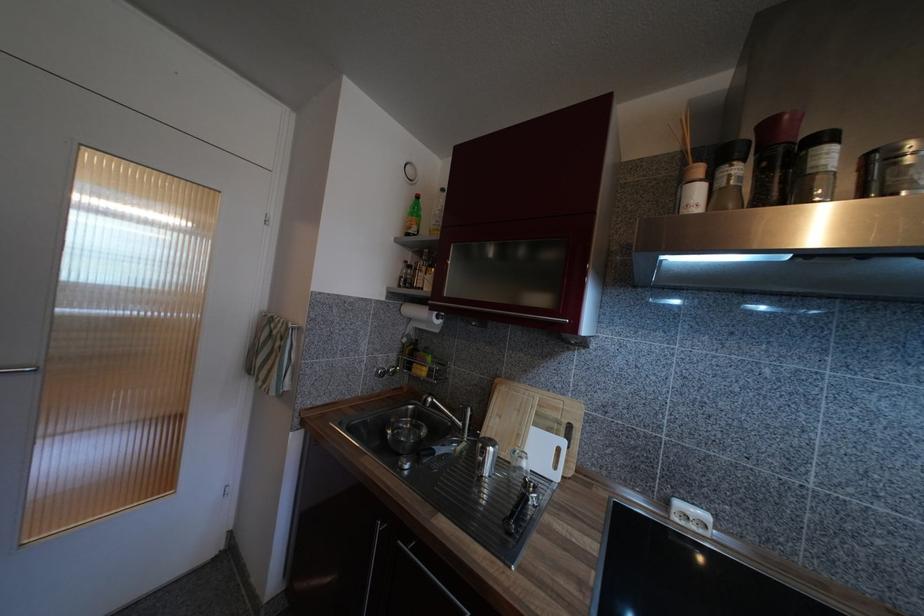
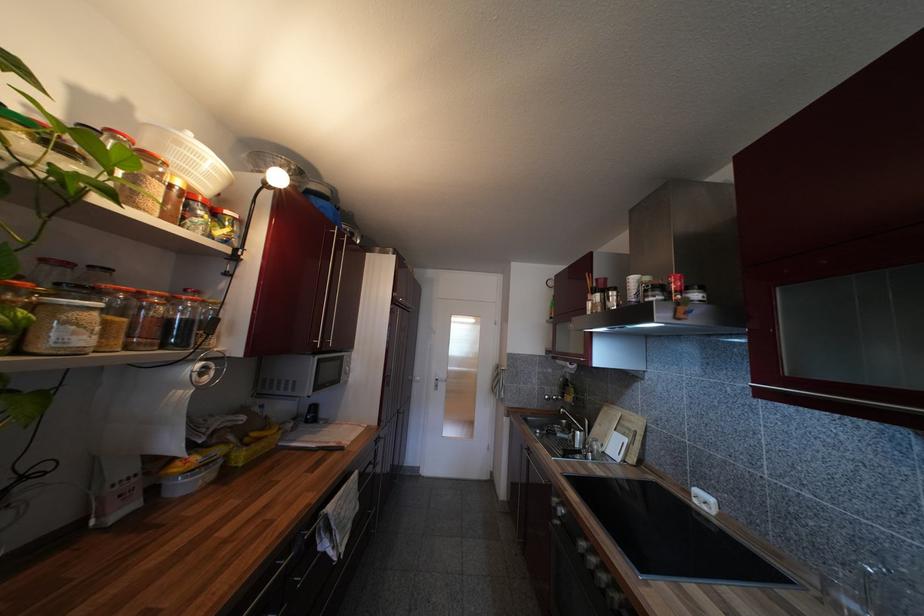
In the second image, find the point that corresponds to point (421, 379) in the first image.

(570, 405)